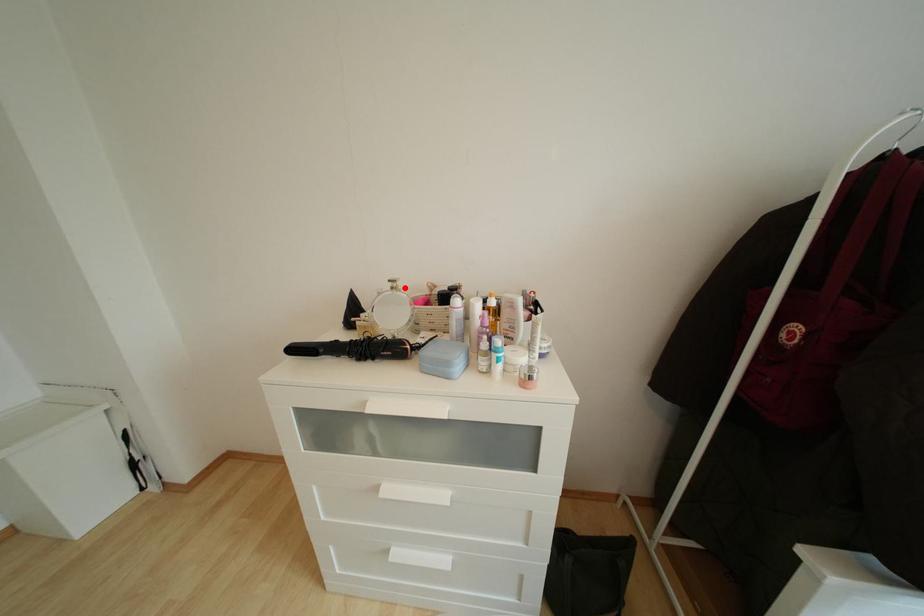
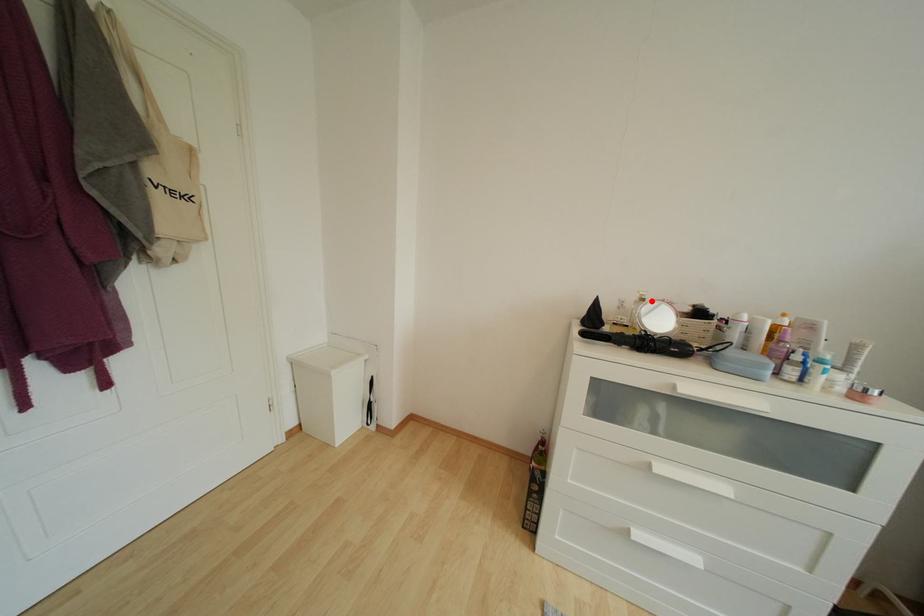
I am providing you with two images of the same scene from different viewpoints. A red point is marked on the first image and another point is marked on the second image. Does the point marked in image1 correspond to the same location as the one in image2?

Yes